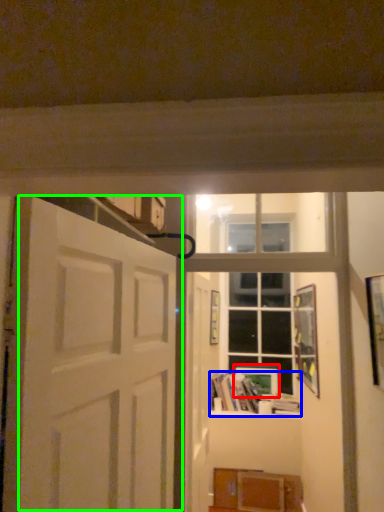
Question: Which is nearer to the picture frame (highlighted by a red box)? book (highlighted by a blue box) or door (highlighted by a green box).

Choices:
 (A) book
 (B) door

Answer: (A)